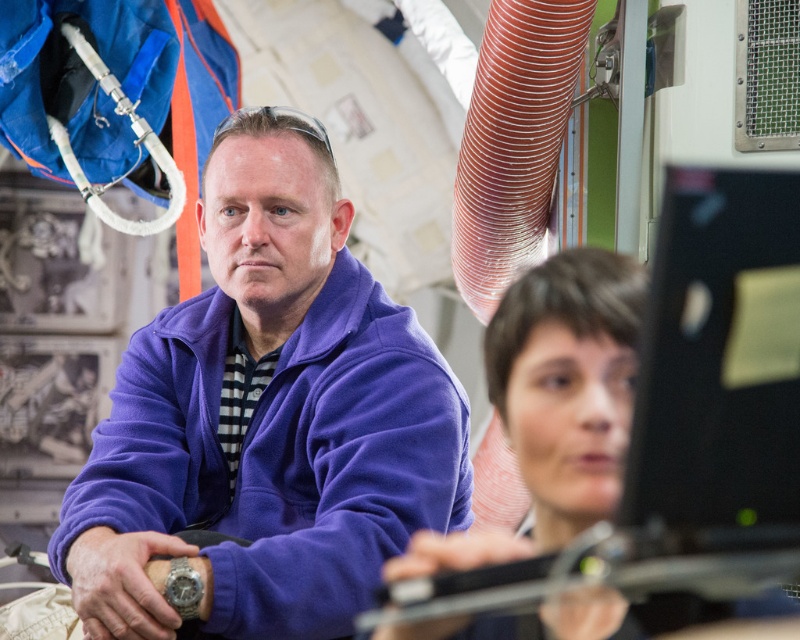
Which is in front, point (400, 323) or point (502, 387)?

Point (502, 387) is in front.

Does purple fleece jacket at center appear over smooth brown hair at center?

No, purple fleece jacket at center is not above smooth brown hair at center.

This screenshot has height=640, width=800. Describe the element at coordinates (268, 419) in the screenshot. I see `purple fleece jacket at center` at that location.

Locate an element on the screen. purple fleece jacket at center is located at coordinates (268, 419).